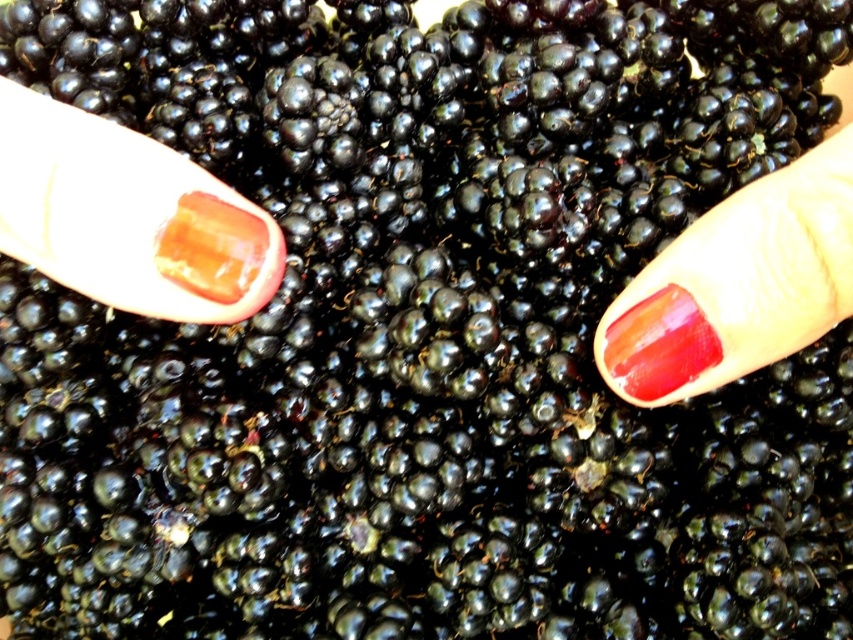
Who is positioned more to the left, red glossy nail at center or glossy red nail polish at center?

Positioned to the left is glossy red nail polish at center.

Between red glossy nail at center and glossy red nail polish at center, which one has less height?

Standing shorter between the two is glossy red nail polish at center.

Describe the element at coordinates (737, 284) in the screenshot. The width and height of the screenshot is (853, 640). I see `red glossy nail at center` at that location.

Where is `red glossy nail at center`? The image size is (853, 640). red glossy nail at center is located at coordinates (737, 284).

Is glossy acrylic nail at upper left to the left of red glossy nail at center from the viewer's perspective?

Indeed, glossy acrylic nail at upper left is positioned on the left side of red glossy nail at center.

Which is in front, point (4, 150) or point (704, 241)?

Point (4, 150) is more forward.

In order to click on glossy acrylic nail at upper left in this screenshot , I will do `click(128, 216)`.

Who is shorter, glossy red nail polish at center or translucent amber cube at center?

translucent amber cube at center

Is point (625, 387) positioned before point (170, 260)?

No, it is behind (170, 260).

This screenshot has width=853, height=640. In order to click on glossy red nail polish at center in this screenshot , I will do `click(659, 344)`.